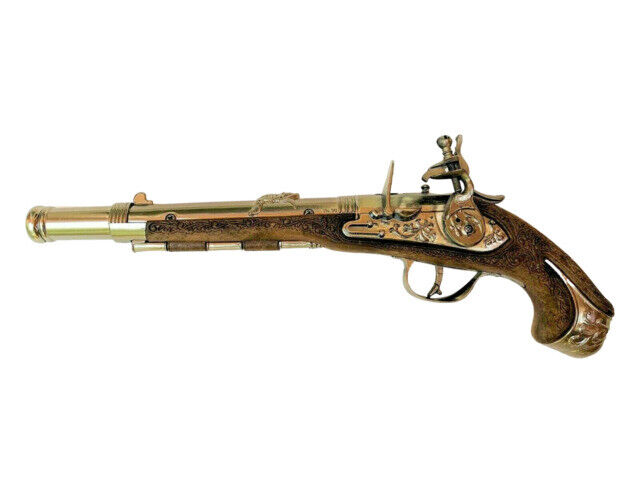
The width and height of the screenshot is (640, 480). I want to click on handle, so click(564, 297).